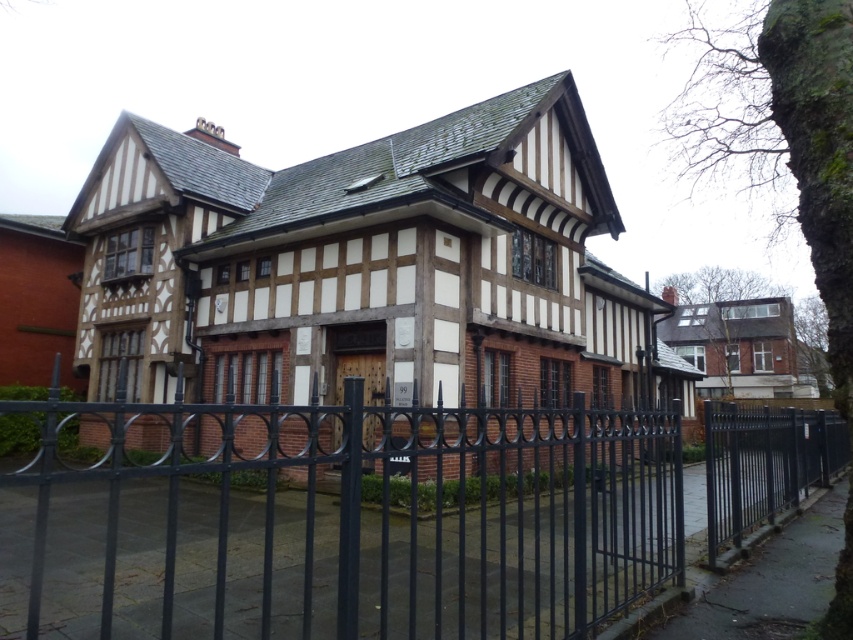
You are standing in front of the Tudor building and want to walk from the black metal fence at center to the black metal fence at right. Which direction should you move to reach the destination?

You should move to your right because the black metal fence at center is to the left of the black metal fence at right.

You are standing in front of the Tudor building and want to enter through the entrance. Where is the black metal fence at center located in relation to the entrance?

The black metal fence at center is located at point (347,516), which is to the right of the entrance.